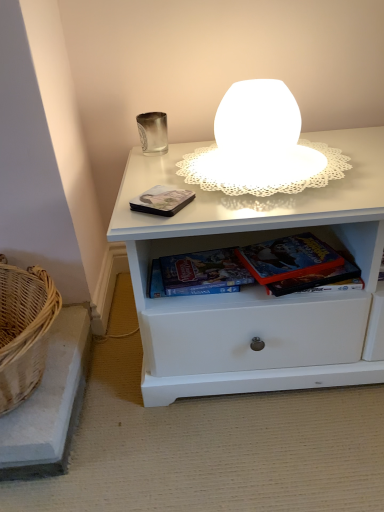
Question: From the image's perspective, is white frosted glass table lamp at upper center positioned above or below metallic matte book at center, arranged as the first paperback book when viewed from the left?

Choices:
 (A) above
 (B) below

Answer: (A)

Question: Is white frosted glass table lamp at upper center situated inside metallic matte book at center, arranged as the first paperback book when viewed from the left, or outside?

Choices:
 (A) outside
 (B) inside

Answer: (A)

Question: Estimate the real-world distances between objects in this image. Which object is farther from the woven wicker basket at lower left?

Choices:
 (A) hardcover book at center, the second paperback book in the left-to-right sequence
 (B) hardcover book at lower center, which ranks as the third paperback book in left-to-right order
 (C) white frosted glass table lamp at upper center
 (D) silver metallic cup at upper left
 (E) metallic matte book at center, the third paperback book in the right-to-left sequence

Answer: (D)

Question: Considering the real-world distances, which object is closest to the metallic matte book at center, arranged as the first paperback book when viewed from the left?

Choices:
 (A) hardcover book at lower center, acting as the 1th paperback book starting from the right
 (B) hardcover book at center, the second paperback book in the left-to-right sequence
 (C) white frosted glass table lamp at upper center
 (D) woven wicker basket at lower left
 (E) silver metallic cup at upper left

Answer: (C)